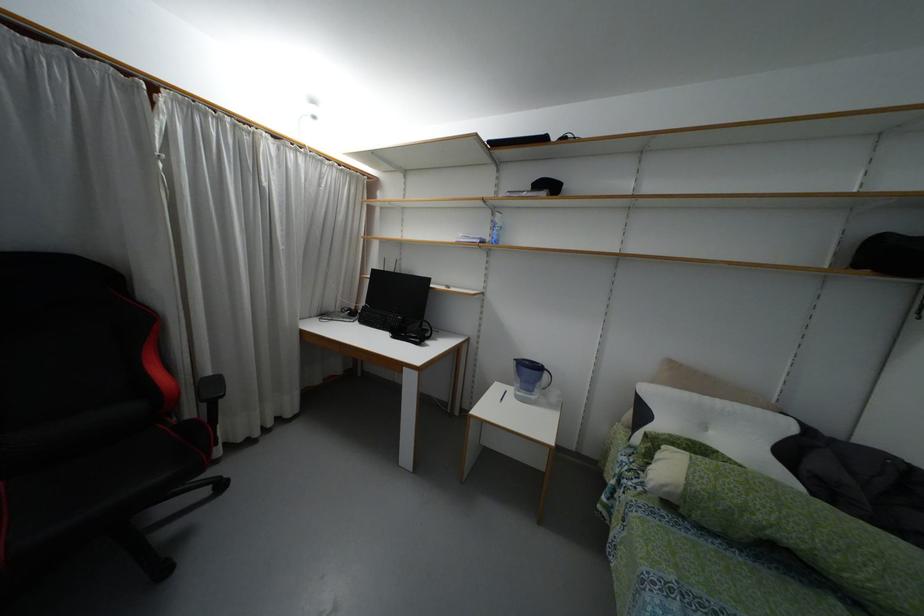
Find where to lift the green bolster pillow. Please return your answer as a coordinate pair (x, y).

(793, 528)